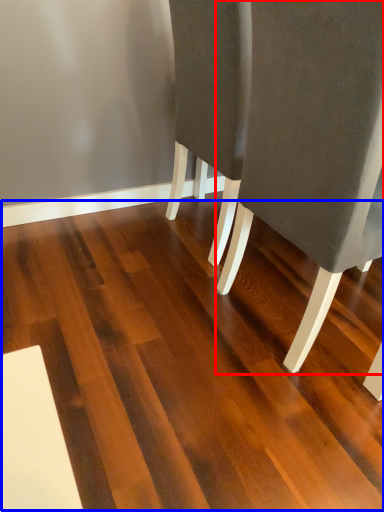
Question: Which of the following is the farthest to the observer, chair (highlighted by a red box) or hardwood (highlighted by a blue box)?

Choices:
 (A) chair
 (B) hardwood

Answer: (A)